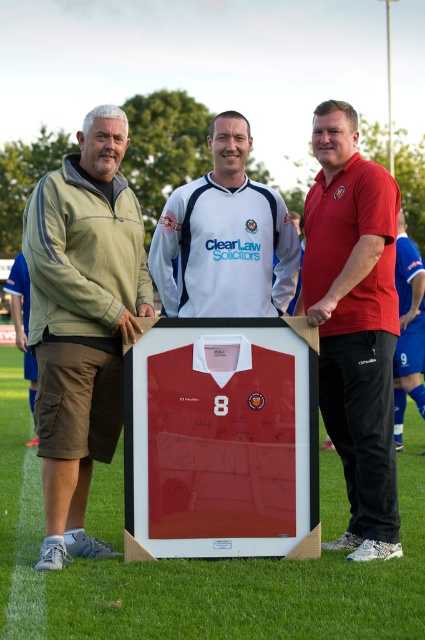
Does smooth glass frame at center have a lesser width compared to green fabric pants at left?

Incorrect, smooth glass frame at center's width is not less than green fabric pants at left's.

Can you confirm if smooth glass frame at center is positioned above green fabric pants at left?

Incorrect, smooth glass frame at center is not positioned above green fabric pants at left.

Is point (357, 612) less distant than point (45, 420)?

Yes.

At what (x,y) coordinates should I click in order to perform the action: click on smooth glass frame at center. Please return your answer as a coordinate pair (x, y). The height and width of the screenshot is (640, 425). Looking at the image, I should click on (198, 570).

Does matte red polo shirt at center have a larger size compared to white jersey at center?

Yes, matte red polo shirt at center is bigger than white jersey at center.

Is point (337, 285) less distant than point (180, 292)?

Yes.

Locate an element on the screen. The image size is (425, 640). matte red polo shirt at center is located at coordinates click(x=354, y=323).

Is point (87, 380) behind point (408, 376)?

No, (87, 380) is closer to viewer.

Can you confirm if green fabric pants at left is positioned to the right of blue jersey at center?

No, green fabric pants at left is not to the right of blue jersey at center.

Locate an element on the screen. Image resolution: width=425 pixels, height=640 pixels. green fabric pants at left is located at coordinates (82, 321).

Locate an element on the screen. The height and width of the screenshot is (640, 425). green fabric pants at left is located at coordinates (82, 321).